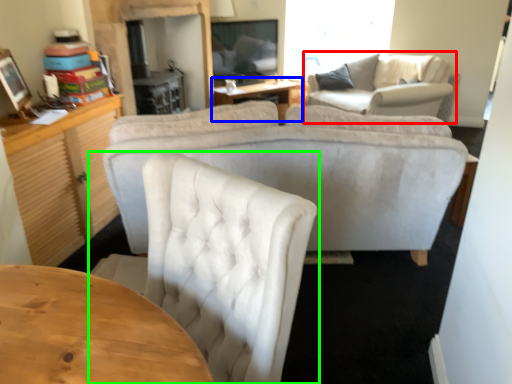
Question: Considering the real-world distances, which object is farthest from couch (highlighted by a red box)? table (highlighted by a blue box) or chair (highlighted by a green box)?

Choices:
 (A) table
 (B) chair

Answer: (B)